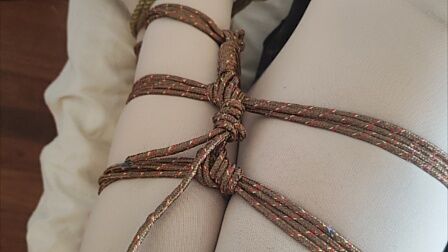
This screenshot has height=252, width=448. What are the coordinates of `wooden floor` in the screenshot? It's located at (29, 102).